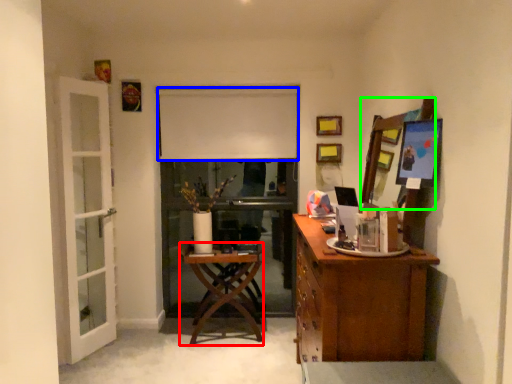
Question: Estimate the real-world distances between objects in this image. Which object is closer to desk (highlighted by a red box), curtain (highlighted by a blue box) or mirror (highlighted by a green box)?

Choices:
 (A) curtain
 (B) mirror

Answer: (A)